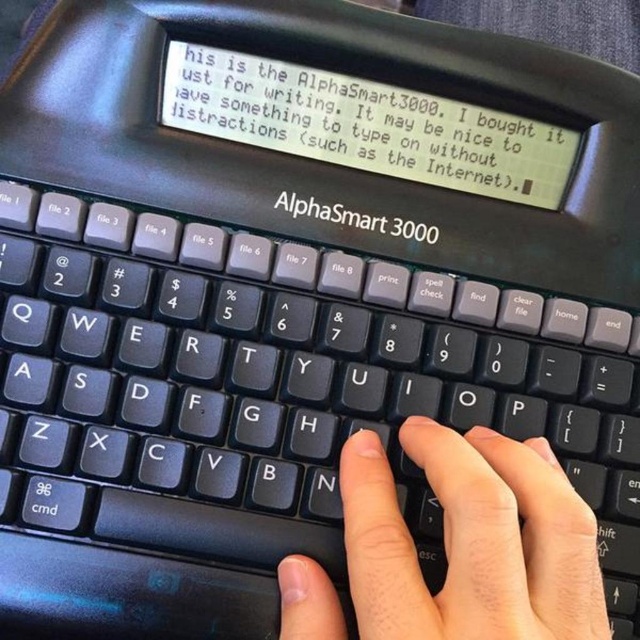
Does black plastic keyboard at center have a smaller size compared to skinny white hand at center?

No, black plastic keyboard at center is not smaller than skinny white hand at center.

At what (x,y) coordinates should I click in order to perform the action: click on black plastic keyboard at center. Please return your answer as a coordinate pair (x, y). Looking at the image, I should click on (259, 412).

Between point (476, 384) and point (387, 618), which one is positioned behind?

Positioned behind is point (476, 384).

The height and width of the screenshot is (640, 640). What are the coordinates of `black plastic keyboard at center` in the screenshot? It's located at (259, 412).